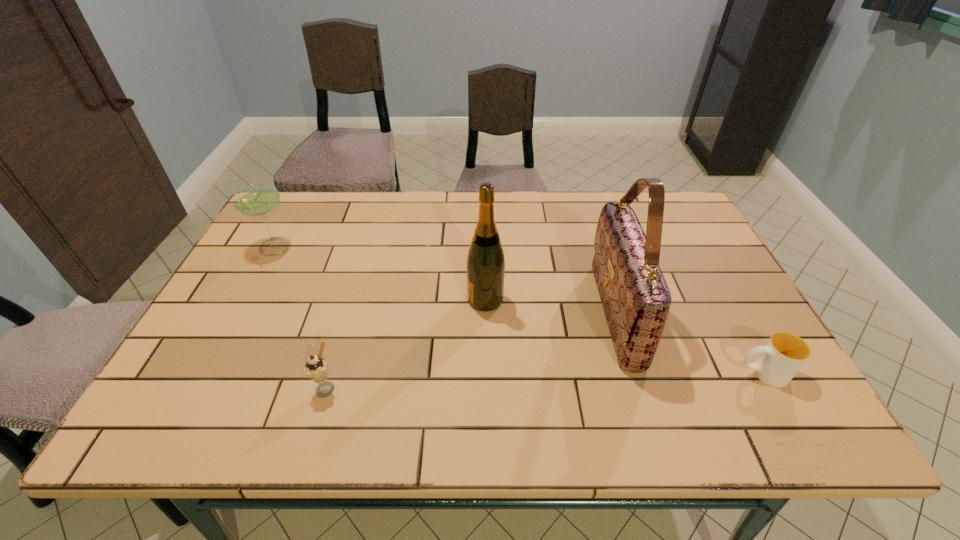
Identify which object is located as the second nearest to the icecream. Please provide its 2D coordinates. Your answer should be formatted as a tuple, i.e. [(x, y)], where the tuple contains the x and y coordinates of a point satisfying the conditions above.

[(260, 199)]

Where is `object that is the fourth closest one to the rightmost object`? The width and height of the screenshot is (960, 540). object that is the fourth closest one to the rightmost object is located at coordinates (260, 199).

Where is `free location that satisfies the following two spatial constraints: 1. with the handle on the side of the shortest object; 2. on the front of the handbag with the clasp`? The width and height of the screenshot is (960, 540). free location that satisfies the following two spatial constraints: 1. with the handle on the side of the shortest object; 2. on the front of the handbag with the clasp is located at coordinates (729, 313).

Find the location of a particular element. This screenshot has height=540, width=960. vacant space that satisfies the following two spatial constraints: 1. with the handle on the side of the shortest object; 2. on the front of the fourth object from left to right with the clasp is located at coordinates (729, 313).

The width and height of the screenshot is (960, 540). In order to click on vacant position in the image that satisfies the following two spatial constraints: 1. with the handle on the side of the rightmost object; 2. on the front of the second object from right to left with the clasp in this screenshot , I will do `click(729, 313)`.

Where is `free space that satisfies the following two spatial constraints: 1. with the handle on the side of the cup; 2. on the front-facing side of the third object from right to left`? The height and width of the screenshot is (540, 960). free space that satisfies the following two spatial constraints: 1. with the handle on the side of the cup; 2. on the front-facing side of the third object from right to left is located at coordinates [x=721, y=300].

The width and height of the screenshot is (960, 540). In order to click on vacant space that satisfies the following two spatial constraints: 1. on the front of the handbag with the clasp; 2. with the handle on the side of the rightmost object in this screenshot , I will do `click(634, 373)`.

Locate an element on the screen. This screenshot has width=960, height=540. free space that satisfies the following two spatial constraints: 1. on the front of the second object from right to left with the clasp; 2. with the handle on the side of the rightmost object is located at coordinates (634, 373).

Identify the location of free region that satisfies the following two spatial constraints: 1. on the back side of the second object from left to right; 2. with the handle on the side of the rightmost object. (330, 373).